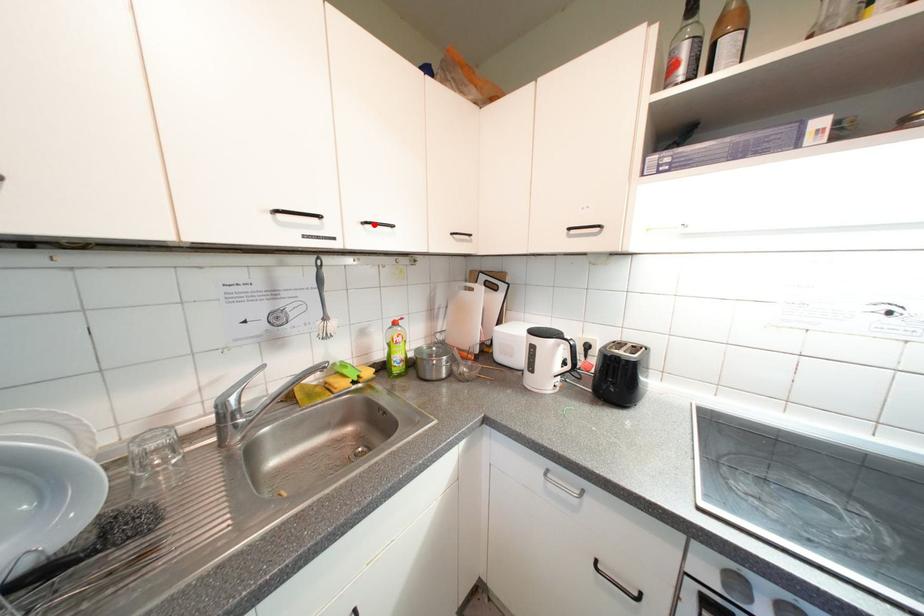
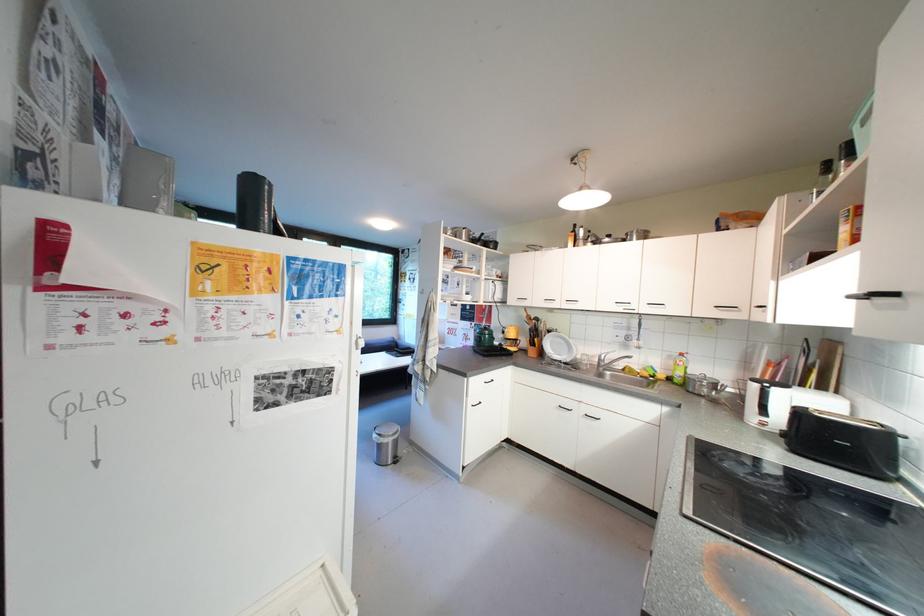
Locate, in the second image, the point that corresponds to the highlighted location in the first image.

(657, 306)